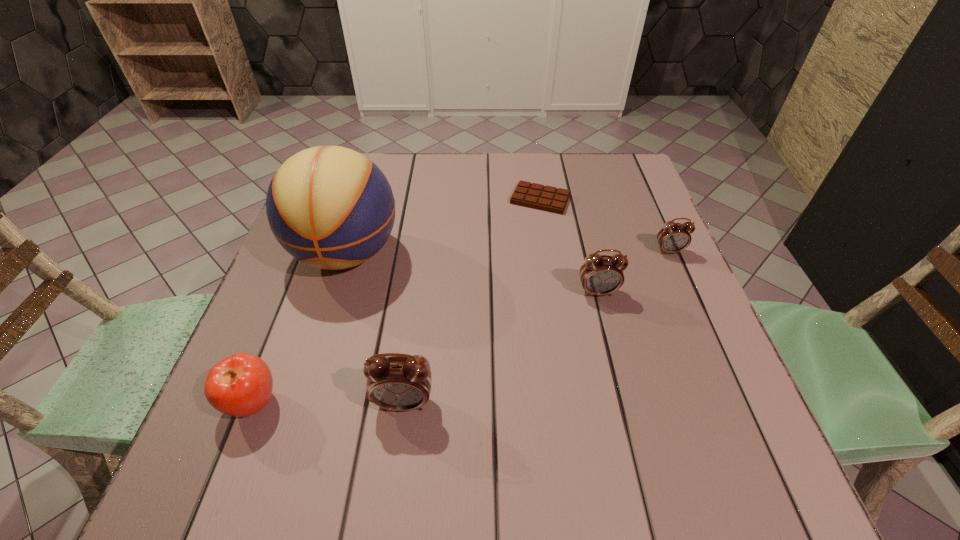
Image resolution: width=960 pixels, height=540 pixels. In order to click on object that is at the near left corner in this screenshot , I will do `click(240, 385)`.

At what (x,y) coordinates should I click in order to perform the action: click on free space at the far edge. Please return your answer as a coordinate pair (x, y). Looking at the image, I should click on (393, 175).

What are the coordinates of `free location at the near edge of the desktop` in the screenshot? It's located at click(333, 392).

The width and height of the screenshot is (960, 540). What are the coordinates of `free region at the left edge of the desktop` in the screenshot? It's located at (302, 282).

At what (x,y) coordinates should I click in order to perform the action: click on free space at the right edge of the desktop. Please return your answer as a coordinate pair (x, y). Looking at the image, I should click on (656, 230).

Identify the location of vacant area at the far right corner of the desktop. (630, 172).

The image size is (960, 540). Find the location of `vacant area at the near right corner`. vacant area at the near right corner is located at coordinates (734, 410).

The image size is (960, 540). What are the coordinates of `free space between the leftmost alarm clock and the second alarm clock from right to left` in the screenshot? It's located at (501, 347).

The width and height of the screenshot is (960, 540). Find the location of `empty space that is in between the apple and the basketball`. empty space that is in between the apple and the basketball is located at coordinates (300, 328).

Identify the location of free space between the nearest alarm clock and the shortest object. (472, 301).